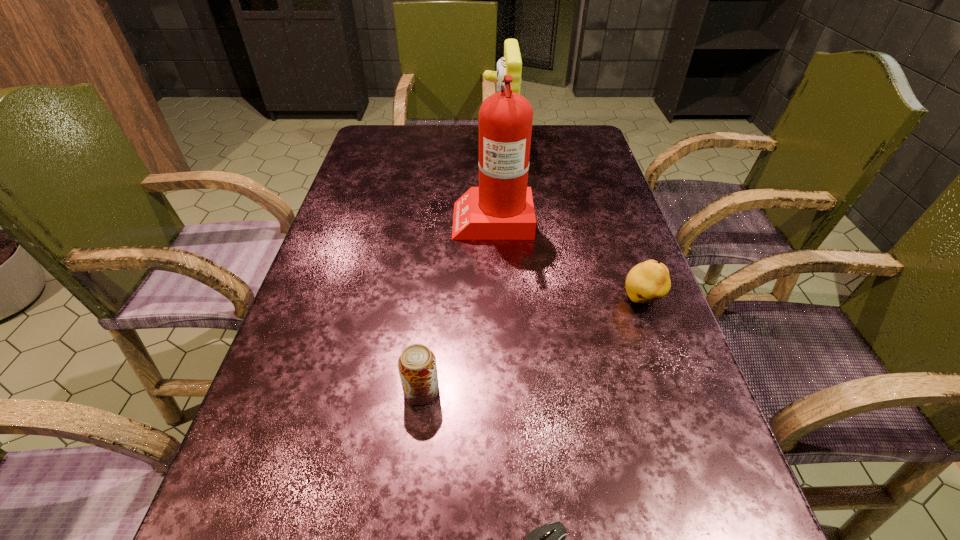
At what (x,y) coordinates should I click in order to perform the action: click on free space located on the front-facing side of the fire extinguisher. Please return your answer as a coordinate pair (x, y). Image resolution: width=960 pixels, height=540 pixels. Looking at the image, I should click on (353, 218).

Locate an element on the screen. free space located 0.120m on the face of the second tallest object is located at coordinates (444, 148).

Find the location of a particular element. This screenshot has height=540, width=960. vacant region located on the face of the second tallest object is located at coordinates (467, 148).

You are a GUI agent. You are given a task and a screenshot of the screen. Output one action in this format:
    pyautogui.click(x=<x>, y=<y>)
    Task: Click on the vacant space located 0.260m on the face of the second tallest object
    
    Given the screenshot: What is the action you would take?
    pyautogui.click(x=398, y=148)

Where is `free space located 0.120m on the back of the rightmost object`? The height and width of the screenshot is (540, 960). free space located 0.120m on the back of the rightmost object is located at coordinates pyautogui.click(x=623, y=249).

You are a GUI agent. You are given a task and a screenshot of the screen. Output one action in this format:
    pyautogui.click(x=<x>, y=<y>)
    Task: Click on the blank space located on the back of the beer can
    This screenshot has height=540, width=960.
    Given the screenshot: What is the action you would take?
    pyautogui.click(x=434, y=276)

At what (x,y) coordinates should I click in order to perform the action: click on object that is at the far edge. Please return your answer as a coordinate pair (x, y). Image resolution: width=960 pixels, height=540 pixels. Looking at the image, I should click on (510, 64).

In order to click on object located at the right edge in this screenshot , I will do `click(646, 282)`.

Where is `vacant point at the left edge`? The width and height of the screenshot is (960, 540). vacant point at the left edge is located at coordinates (x=353, y=172).

Find the location of `free spot at the right edge of the desktop`. free spot at the right edge of the desktop is located at coordinates (623, 250).